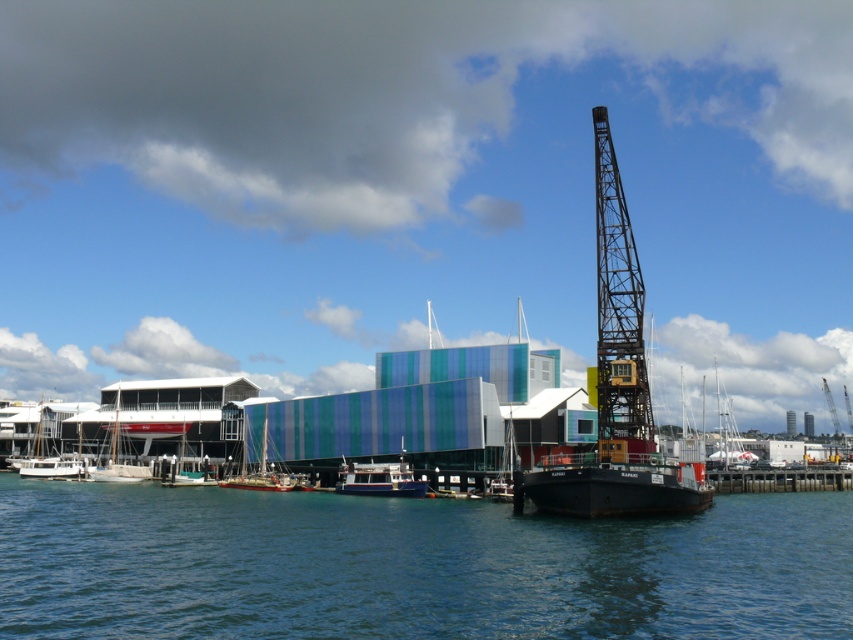
You are a photographer planning to take a photo of the waterfront scene. You need to ensure that both the smooth concrete dock at lower right and the wooden sailboat at lower center are clearly visible in the frame. Based on their heights, which object might require you to adjust your camera angle to avoid being blocked by the other?

The smooth concrete dock at lower right is not as tall as the wooden sailboat at lower center, so the wooden sailboat at lower center might block the view of the dock. To ensure both are visible, you may need to angle the camera downward slightly to include the shorter dock while still capturing the taller sailboat.

You are standing at the origin point of the image coordinate system, which is the bottom left corner. You need to locate the white glossy boat at center. What are its coordinates?

The white glossy boat at center is located at coordinates point (379, 477).

You are standing at the waterfront and see two points marked in the image. Which point, point (785,486) or point (242,461), is closer to you?

Point (785,486) is closer to the viewer than point (242,461).